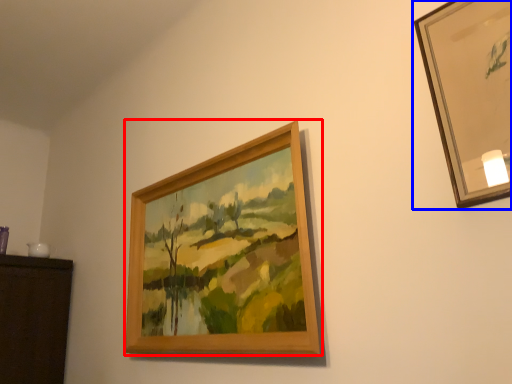
Question: Which point is further to the camera, picture frame (highlighted by a red box) or picture frame (highlighted by a blue box)?

Choices:
 (A) picture frame
 (B) picture frame

Answer: (A)